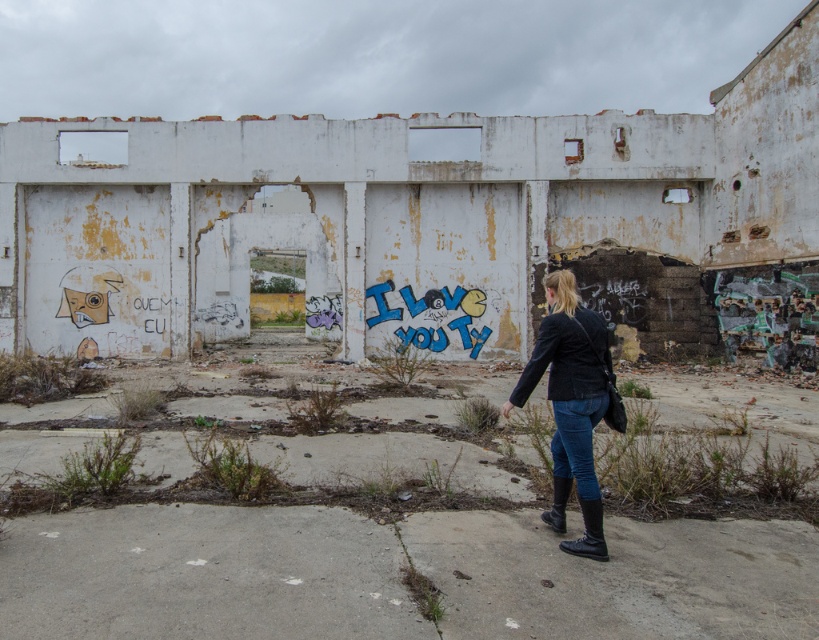
You are standing at the entrance of the abandoned building and see two points marked on the wall. The first point is at coordinates point (591, 417) and the second is at point (546, 515). Which point is closer to you?

Point (591, 417) is in front of point (546, 515), so the first point is closer to you.

You are a photographer trying to capture both the black leather boot at lower right and the black rubber boot at lower right in a single frame. Since both are at the lower right, which one should you move closer to the camera to ensure both are fully visible?

The black leather boot at lower right is shorter than the black rubber boot at lower right, so you should move the black leather boot at lower right closer to the camera to ensure both are fully visible.